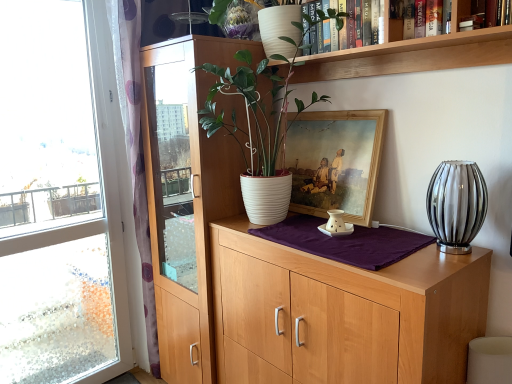
Question: Would you say white ribbed pot at center contains transparent glass window at left?

Choices:
 (A) no
 (B) yes

Answer: (A)

Question: Is white ribbed pot at center to the left of transparent glass window at left from the viewer's perspective?

Choices:
 (A) yes
 (B) no

Answer: (B)

Question: Does white ribbed pot at center appear on the right side of transparent glass window at left?

Choices:
 (A) no
 (B) yes

Answer: (B)

Question: Is the position of white ribbed pot at center more distant than that of transparent glass window at left?

Choices:
 (A) yes
 (B) no

Answer: (B)

Question: From the image's perspective, is white ribbed pot at center under transparent glass window at left?

Choices:
 (A) yes
 (B) no

Answer: (B)

Question: From the image's perspective, relative to translucent glass vase at right, is hardcover book at upper right, which appears as the first book when viewed from the front, above or below?

Choices:
 (A) below
 (B) above

Answer: (B)

Question: Is hardcover book at upper right, marked as the 3th book in a back-to-front arrangement, taller or shorter than translucent glass vase at right?

Choices:
 (A) tall
 (B) short

Answer: (B)

Question: Considering the positions of hardcover book at upper right, marked as the 3th book in a back-to-front arrangement, and translucent glass vase at right in the image, is hardcover book at upper right, marked as the 3th book in a back-to-front arrangement, bigger or smaller than translucent glass vase at right?

Choices:
 (A) big
 (B) small

Answer: (B)

Question: Considering their positions, is hardcover book at upper right, which is the third book in left-to-right order, located in front of or behind translucent glass vase at right?

Choices:
 (A) behind
 (B) front

Answer: (B)

Question: From a real-world perspective, is hardcover book at upper right, the second book positioned from the back, physically located above or below translucent glass vase at right?

Choices:
 (A) below
 (B) above

Answer: (B)

Question: Is point (394, 21) closer or farther from the camera than point (441, 183)?

Choices:
 (A) farther
 (B) closer

Answer: (A)

Question: In the image, is hardcover book at upper right, which is the 2th book in right-to-left order, on the left side or the right side of translucent glass vase at right?

Choices:
 (A) left
 (B) right

Answer: (A)

Question: In the image, is hardcover book at upper right, acting as the 2th book starting from the left, positioned in front of or behind translucent glass vase at right?

Choices:
 (A) front
 (B) behind

Answer: (A)

Question: From the image's perspective, is light wood cabinet at center above or below white matte shelf at upper center?

Choices:
 (A) above
 (B) below

Answer: (B)

Question: Looking at the image, does light wood cabinet at center seem bigger or smaller compared to white matte shelf at upper center?

Choices:
 (A) small
 (B) big

Answer: (B)